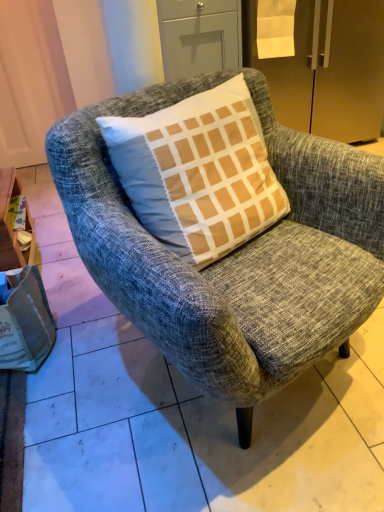
What do you see at coordinates (234, 251) in the screenshot? This screenshot has width=384, height=512. I see `textured gray armchair at center` at bounding box center [234, 251].

Find the location of a particular element. This screenshot has height=512, width=384. satin gold refrigerator at upper right is located at coordinates (327, 70).

This screenshot has width=384, height=512. What do you see at coordinates (327, 70) in the screenshot?
I see `satin gold refrigerator at upper right` at bounding box center [327, 70].

Find the location of `wooden at left`. wooden at left is located at coordinates (11, 225).

From the image's perspective, who appears lower, white paper bag at lower left or wooden at left?

white paper bag at lower left, from the image's perspective.

How much distance is there between white paper bag at lower left and wooden at left?

white paper bag at lower left is 9.86 inches away from wooden at left.

Does white paper bag at lower left come behind wooden at left?

No, white paper bag at lower left is in front of wooden at left.

Is white paper bag at lower left positioned beyond the bounds of wooden at left?

white paper bag at lower left is positioned outside wooden at left.

Who is more distant, matte gray drawer at upper center or satin gold refrigerator at upper right?

matte gray drawer at upper center is more distant.

Is matte gray drawer at upper center in contact with satin gold refrigerator at upper right?

No, matte gray drawer at upper center is not next to satin gold refrigerator at upper right.

What's the angular difference between matte gray drawer at upper center and satin gold refrigerator at upper right's facing directions?

The facing directions of matte gray drawer at upper center and satin gold refrigerator at upper right are 9.33e-05 degrees apart.

Identify the location of drawer behind the satin gold refrigerator at upper right. (199, 36).

Based on the photo, from a real-world perspective, does white paper bag at lower left sit lower than satin gold refrigerator at upper right?

Yes, from a real-world perspective, white paper bag at lower left is under satin gold refrigerator at upper right.

Is white paper bag at lower left wider than satin gold refrigerator at upper right?

In fact, white paper bag at lower left might be narrower than satin gold refrigerator at upper right.

Considering the relative sizes of white paper bag at lower left and satin gold refrigerator at upper right in the image provided, is white paper bag at lower left shorter than satin gold refrigerator at upper right?

Indeed, white paper bag at lower left has a lesser height compared to satin gold refrigerator at upper right.

Between textured gray armchair at center and white paper bag at lower left, which one is positioned behind?

Positioned behind is white paper bag at lower left.

Is textured gray armchair at center facing away from white paper bag at lower left?

No, white paper bag at lower left is not at the back of textured gray armchair at center.

Would you say textured gray armchair at center is outside white paper bag at lower left?

textured gray armchair at center lies outside white paper bag at lower left's area.

Can you tell me how much wooden at left and matte gray drawer at upper center differ in facing direction?

wooden at left and matte gray drawer at upper center are facing 88.6 degrees away from each other.

Is point (1, 210) closer to camera compared to point (198, 73)?

Yes, point (1, 210) is closer to viewer.

Is wooden at left placed right next to matte gray drawer at upper center?

wooden at left and matte gray drawer at upper center are not in contact.

Is wooden at left looking in the opposite direction of matte gray drawer at upper center?

No.

Between wooden at left and white paper bag at lower left, which one has less height?

white paper bag at lower left is shorter.

Considering the relative sizes of wooden at left and white paper bag at lower left in the image provided, is wooden at left wider than white paper bag at lower left?

No.

From the picture: Is wooden at left situated inside white paper bag at lower left or outside?

wooden at left is located beyond the bounds of white paper bag at lower left.

Who is shorter, matte gray drawer at upper center or textured gray armchair at center?

Standing shorter between the two is matte gray drawer at upper center.

Do you think matte gray drawer at upper center is within textured gray armchair at center, or outside of it?

matte gray drawer at upper center is not inside textured gray armchair at center, it's outside.

From a real-world perspective, between matte gray drawer at upper center and textured gray armchair at center, who is vertically higher?

In real-world perspective, matte gray drawer at upper center is above.

Image resolution: width=384 pixels, height=512 pixels. In order to click on table located behind the white paper bag at lower left in this screenshot , I will do `click(11, 225)`.

At what (x,y) coordinates should I click in order to perform the action: click on drawer that is above the satin gold refrigerator at upper right (from the image's perspective). Please return your answer as a coordinate pair (x, y). Looking at the image, I should click on (199, 36).

When comparing their distances from wooden at left, does textured gray armchair at center or white paper bag at lower left seem closer?

Based on the image, white paper bag at lower left appears to be nearer to wooden at left.

When comparing their distances from matte gray drawer at upper center, does white paper bag at lower left or textured gray armchair at center seem further?

white paper bag at lower left lies further to matte gray drawer at upper center than the other object.

Based on the photo, considering their positions, is matte gray drawer at upper center positioned closer to wooden at left than textured gray armchair at center?

textured gray armchair at center lies closer to wooden at left than the other object.

Which object lies nearer to the anchor point wooden at left, textured gray armchair at center or satin gold refrigerator at upper right?

textured gray armchair at center.

Looking at the image, which one is located closer to white paper bag at lower left, matte gray drawer at upper center or wooden at left?

wooden at left.

From the image, which object appears to be farther from textured gray armchair at center, satin gold refrigerator at upper right or white paper bag at lower left?

satin gold refrigerator at upper right is positioned further to the anchor textured gray armchair at center.

Estimate the real-world distances between objects in this image. Which object is closer to satin gold refrigerator at upper right, wooden at left or white paper bag at lower left?

wooden at left lies closer to satin gold refrigerator at upper right than the other object.

Based on their spatial positions, is textured gray armchair at center or matte gray drawer at upper center further from white paper bag at lower left?

matte gray drawer at upper center is further to white paper bag at lower left.

Where is `box situated between wooden at left and satin gold refrigerator at upper right from left to right`? The height and width of the screenshot is (512, 384). box situated between wooden at left and satin gold refrigerator at upper right from left to right is located at coordinates (24, 320).

Locate an element on the screen. This screenshot has height=512, width=384. drawer situated between wooden at left and satin gold refrigerator at upper right from left to right is located at coordinates (199, 36).

The height and width of the screenshot is (512, 384). Find the location of `chair between matte gray drawer at upper center and white paper bag at lower left vertically`. chair between matte gray drawer at upper center and white paper bag at lower left vertically is located at coordinates (234, 251).

Image resolution: width=384 pixels, height=512 pixels. I want to click on table between matte gray drawer at upper center and white paper bag at lower left in the vertical direction, so click(x=11, y=225).